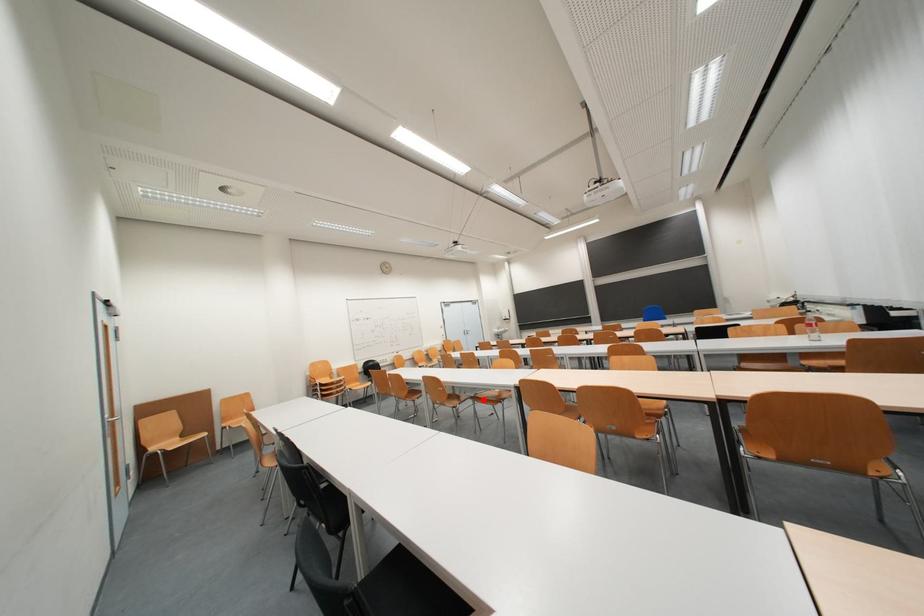
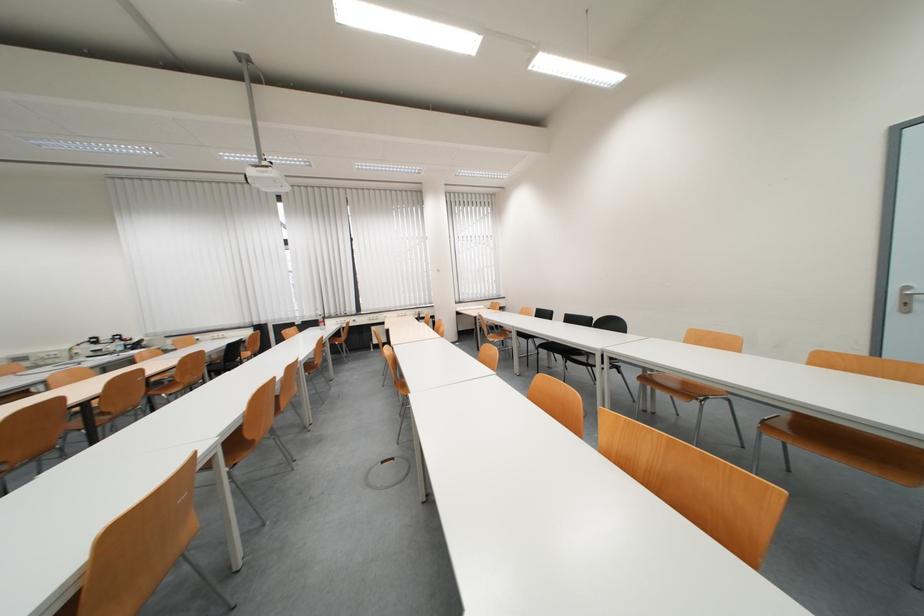
Question: I am providing you with two images of the same scene from different viewpoints. A red point is marked on the first image. At the location where the point appears in image 1, is it still visible in image 2?

Choices:
 (A) Yes
 (B) No

Answer: (B)